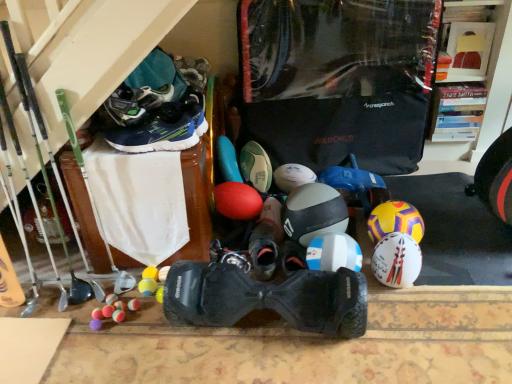
Question: Relative to rubber ball at center, is green matte soccer ball at center, the 5th footwear when ordered from front to back, in front or behind?

Choices:
 (A) front
 (B) behind

Answer: (B)

Question: Is green matte soccer ball at center, the 5th footwear when ordered from front to back, wider or thinner than rubber ball at center?

Choices:
 (A) wide
 (B) thin

Answer: (B)

Question: Which is nearer to the green synthetic running shoe at upper left, which is the 3th footwear in front-to-back order?

Choices:
 (A) dark blue synthetic sneakers at upper left, placed as the second footwear when sorted from front to back
 (B) white matte helmet at center, the 2th helmet when ordered from right to left
 (C) white matte helmet at right, which is the 4th helmet in left-to-right order
 (D) green matte soccer ball at center, the 5th footwear when ordered from front to back
 (E) white matte soccer ball at center

Answer: (A)

Question: Which of these objects is positioned closest to the rubber ball at center?

Choices:
 (A) white matte helmet at center, the 1th helmet in the left-to-right sequence
 (B) white matte helmet at center, acting as the 2th helmet starting from the left
 (C) green matte soccer ball at center, marked as the 1th footwear in a back-to-front arrangement
 (D) dark blue synthetic sneakers at upper left, placed as the second footwear when sorted from front to back
 (E) black matte sneaker at center, which is counted as the 4th footwear, starting from the front

Answer: (A)